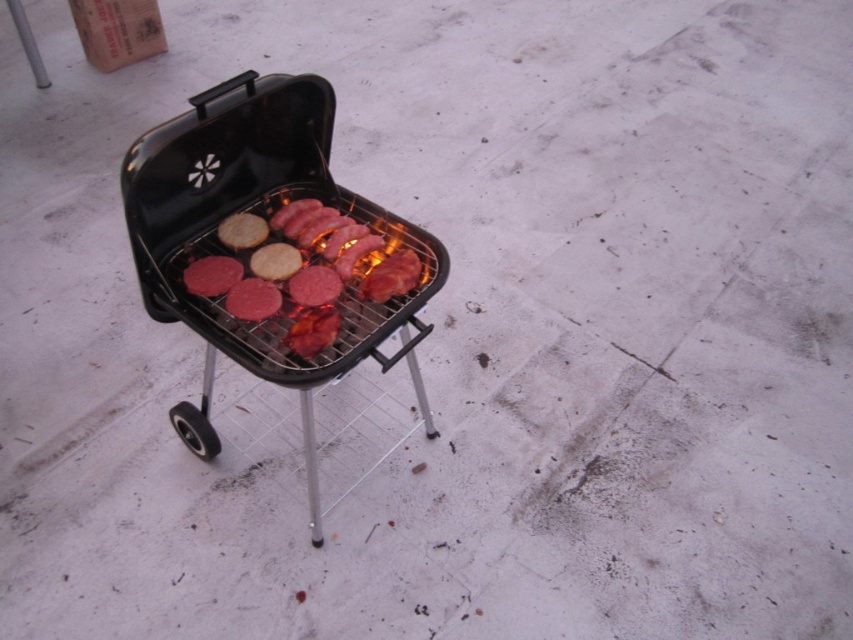
Is black matte barbecue grill at center in front of pink matte burger patty at center?

Yes, black matte barbecue grill at center is closer to the viewer.

Does black matte barbecue grill at center appear under pink matte burger patty at center?

Indeed, black matte barbecue grill at center is positioned under pink matte burger patty at center.

Who is more forward, (146, 189) or (212, 292)?

Point (146, 189) is more forward.

At what (x,y) coordinates should I click in order to perform the action: click on black matte barbecue grill at center. Please return your answer as a coordinate pair (x, y). Image resolution: width=853 pixels, height=640 pixels. Looking at the image, I should click on (265, 218).

Is black matte barbecue grill at center to the right of pink matte hamburger buns at center from the viewer's perspective?

No, black matte barbecue grill at center is not to the right of pink matte hamburger buns at center.

How distant is black matte barbecue grill at center from pink matte hamburger buns at center?

A distance of 3.36 inches exists between black matte barbecue grill at center and pink matte hamburger buns at center.

Does point (227, 189) come farther from viewer compared to point (192, 262)?

Yes, point (227, 189) is farther from viewer.

Image resolution: width=853 pixels, height=640 pixels. In order to click on black matte barbecue grill at center in this screenshot , I will do [265, 218].

Between pink matte hamburger buns at center and pink matte burger patty at center, which one appears on the left side from the viewer's perspective?

pink matte burger patty at center

Can you confirm if pink matte hamburger buns at center is wider than pink matte burger patty at center?

Yes.

Locate an element on the screen. pink matte hamburger buns at center is located at coordinates (300, 269).